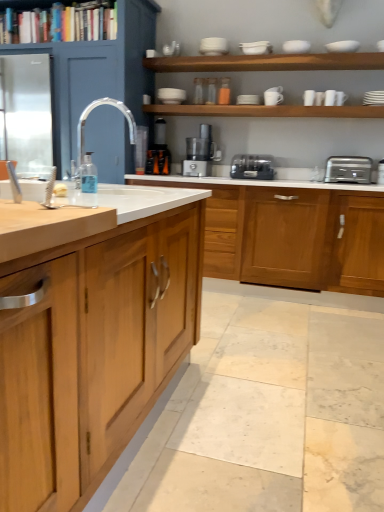
Question: Can you confirm if silver metallic toaster at right is bigger than white ceramic cup at upper center, the fifth tableware in the right-to-left sequence?

Choices:
 (A) yes
 (B) no

Answer: (A)

Question: Can you confirm if silver metallic toaster at right is positioned to the right of white ceramic cup at upper center, which is counted as the seventh tableware, starting from the left?

Choices:
 (A) no
 (B) yes

Answer: (B)

Question: Is silver metallic toaster at right looking in the opposite direction of white ceramic cup at upper center, which is counted as the seventh tableware, starting from the left?

Choices:
 (A) no
 (B) yes

Answer: (A)

Question: Can you confirm if silver metallic toaster at right is thinner than white ceramic cup at upper center, which is counted as the seventh tableware, starting from the left?

Choices:
 (A) yes
 (B) no

Answer: (B)

Question: Does silver metallic toaster at right turn towards white ceramic cup at upper center, which is counted as the seventh tableware, starting from the left?

Choices:
 (A) no
 (B) yes

Answer: (A)

Question: Is silver metallic toaster at right beside white ceramic cup at upper center, which is counted as the seventh tableware, starting from the left?

Choices:
 (A) yes
 (B) no

Answer: (B)

Question: Can stainless steel refrigerator at left be found inside yellow butter at left?

Choices:
 (A) no
 (B) yes

Answer: (A)

Question: Is yellow butter at left turned away from stainless steel refrigerator at left?

Choices:
 (A) yes
 (B) no

Answer: (B)

Question: Is yellow butter at left shorter than stainless steel refrigerator at left?

Choices:
 (A) yes
 (B) no

Answer: (A)

Question: Is yellow butter at left positioned before stainless steel refrigerator at left?

Choices:
 (A) no
 (B) yes

Answer: (B)

Question: Is yellow butter at left aimed at stainless steel refrigerator at left?

Choices:
 (A) yes
 (B) no

Answer: (B)

Question: Does yellow butter at left have a greater width compared to stainless steel refrigerator at left?

Choices:
 (A) no
 (B) yes

Answer: (A)

Question: From a real-world perspective, is white ceramic cup at upper center, which is counted as the seventh tableware, starting from the left, physically below wooden shelf at upper center, acting as the 3th shelf starting from the top?

Choices:
 (A) no
 (B) yes

Answer: (A)